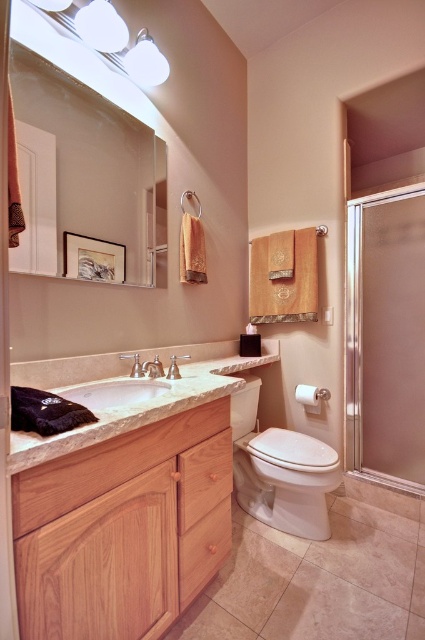
In the scene shown: You are standing in the bathroom and want to reach the point marked as point (57, 221). If you can reach up to 5 feet, will you be able to reach it?

The point (57, 221) is 4.82 feet away from the camera, so yes, you can reach it since it is within your 5 feet reach range.

You are standing in the bathroom and see two points marked in the scene. Which point is closer to you, point (354, 433) or point (265, 451)?

Point (354, 433) is further to the viewer than point (265, 451), so point (265, 451) is closer to you.

You are standing in the bathroom and want to reach the frosted glass shower door at right and the brushed metal faucet at sink left. Which object will you encounter first as you move forward?

You will encounter the frosted glass shower door at right first because it is closer to you than the brushed metal faucet at sink left, which is further away.